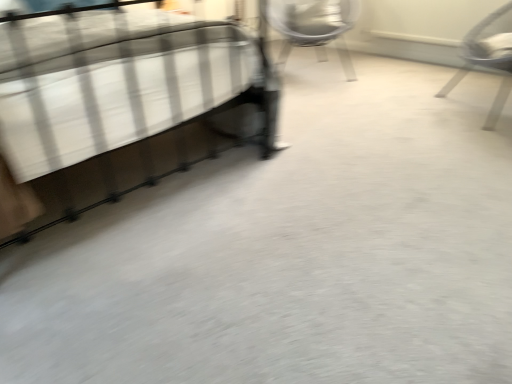
Question: Does metallic silver chair at upper center, which appears as the first chair when viewed from the left, turn towards metallic silver bed at left?

Choices:
 (A) yes
 (B) no

Answer: (B)

Question: Is metallic silver chair at upper center, which appears as the first chair when viewed from the left, looking in the opposite direction of metallic silver bed at left?

Choices:
 (A) yes
 (B) no

Answer: (B)

Question: From the image's perspective, is metallic silver chair at upper center, which is the 2th chair in front-to-back order, located above metallic silver bed at left?

Choices:
 (A) no
 (B) yes

Answer: (B)

Question: From a real-world perspective, is metallic silver chair at upper center, the second chair when ordered from right to left, over metallic silver bed at left?

Choices:
 (A) yes
 (B) no

Answer: (B)

Question: Is metallic silver chair at upper center, the second chair when ordered from right to left, in front of metallic silver bed at left?

Choices:
 (A) no
 (B) yes

Answer: (A)

Question: From the image's perspective, relative to metallic silver bed at left, is metallic silver chair at upper center, which appears as the first chair when viewed from the left, above or below?

Choices:
 (A) above
 (B) below

Answer: (A)

Question: Is metallic silver chair at upper center, which is the 2th chair in front-to-back order, spatially inside metallic silver bed at left, or outside of it?

Choices:
 (A) inside
 (B) outside

Answer: (B)

Question: Is metallic silver chair at upper center, marked as the 1th chair in a back-to-front arrangement, in front of or behind metallic silver bed at left in the image?

Choices:
 (A) behind
 (B) front

Answer: (A)

Question: Considering the positions of metallic silver chair at upper center, marked as the 1th chair in a back-to-front arrangement, and metallic silver bed at left in the image, is metallic silver chair at upper center, marked as the 1th chair in a back-to-front arrangement, wider or thinner than metallic silver bed at left?

Choices:
 (A) thin
 (B) wide

Answer: (A)

Question: From the image's perspective, is metallic silver chair at right, which appears as the 1th chair when viewed from the right, positioned above or below metallic silver bed at left?

Choices:
 (A) above
 (B) below

Answer: (A)

Question: Based on their sizes in the image, would you say metallic silver chair at right, which ranks as the second chair in back-to-front order, is bigger or smaller than metallic silver bed at left?

Choices:
 (A) big
 (B) small

Answer: (B)

Question: From a real-world perspective, is metallic silver chair at right, arranged as the 1th chair when viewed from the front, positioned above or below metallic silver bed at left?

Choices:
 (A) above
 (B) below

Answer: (B)

Question: Considering the positions of point (486, 44) and point (179, 130), is point (486, 44) closer or farther from the camera than point (179, 130)?

Choices:
 (A) closer
 (B) farther

Answer: (A)

Question: Considering the positions of metallic silver chair at right, which ranks as the second chair in back-to-front order, and metallic silver chair at upper center, which appears as the first chair when viewed from the left, in the image, is metallic silver chair at right, which ranks as the second chair in back-to-front order, bigger or smaller than metallic silver chair at upper center, which appears as the first chair when viewed from the left,?

Choices:
 (A) small
 (B) big

Answer: (A)

Question: Relative to metallic silver chair at upper center, which appears as the first chair when viewed from the left, is metallic silver chair at right, the 2th chair viewed from the left, in front or behind?

Choices:
 (A) behind
 (B) front

Answer: (B)